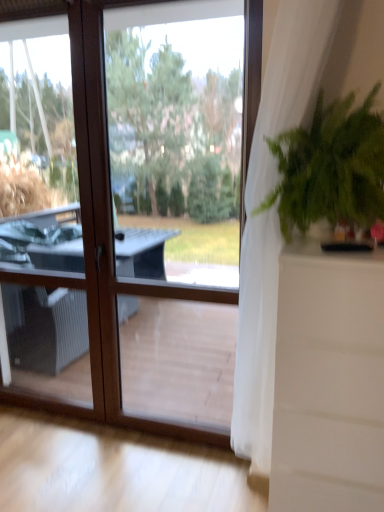
Find the location of a particular element. The width and height of the screenshot is (384, 512). transparent glass window at center is located at coordinates (102, 227).

Where is `green leafy plant at right`? The width and height of the screenshot is (384, 512). green leafy plant at right is located at coordinates (330, 168).

Locate an element on the screen. The image size is (384, 512). white sheer curtain at right is located at coordinates (272, 216).

How different are the orientations of white sheer curtain at right and transparent glass window at center in degrees?

white sheer curtain at right and transparent glass window at center are facing 0.000555 degrees away from each other.

Is white sheer curtain at right facing towards transparent glass window at center?

No, white sheer curtain at right is not turned towards transparent glass window at center.

From the picture: How distant is white sheer curtain at right from transparent glass window at center?

white sheer curtain at right and transparent glass window at center are 31.22 inches apart.

From the image's perspective, is white sheer curtain at right located above or below transparent glass window at center?

Clearly, from the image's perspective, white sheer curtain at right is below transparent glass window at center.

Measure the distance between transparent glass window at center and green leafy plant at right.

89.57 centimeters.

Looking at this image, does transparent glass window at center appear on the right side of green leafy plant at right?

Incorrect, transparent glass window at center is not on the right side of green leafy plant at right.

Locate an element on the screen. Image resolution: width=384 pixels, height=512 pixels. houseplant in front of the transparent glass window at center is located at coordinates (330, 168).

From a real-world perspective, is transparent glass window at center on top of green leafy plant at right?

No, from a real-world perspective, transparent glass window at center is not over green leafy plant at right

How much distance is there between transparent glass window at center and white sheer curtain at right?

transparent glass window at center and white sheer curtain at right are 31.22 inches apart.

Locate an element on the screen. This screenshot has width=384, height=512. window below the white sheer curtain at right (from a real-world perspective) is located at coordinates (102, 227).

Looking at their sizes, would you say transparent glass window at center is wider or thinner than white sheer curtain at right?

transparent glass window at center is thinner than white sheer curtain at right.

Are green leafy plant at right and white sheer curtain at right far apart?

No, green leafy plant at right is not far away from white sheer curtain at right.

From a real-world perspective, is green leafy plant at right above or below white sheer curtain at right?

From a real-world perspective, green leafy plant at right is physically above white sheer curtain at right.

Would you say green leafy plant at right is outside white sheer curtain at right?

That's incorrect, green leafy plant at right is not completely outside white sheer curtain at right.

Which is closer, (379, 162) or (311, 33)?

Point (379, 162) is closer to the camera than point (311, 33).

Is green leafy plant at right with transparent glass window at center?

No, green leafy plant at right is not touching transparent glass window at center.

Looking at this image, considering the sizes of objects green leafy plant at right and transparent glass window at center in the image provided, who is shorter, green leafy plant at right or transparent glass window at center?

green leafy plant at right is shorter.

Is green leafy plant at right situated inside transparent glass window at center or outside?

The correct answer is: outside.

Who is shorter, white sheer curtain at right or green leafy plant at right?

green leafy plant at right.

Between point (288, 11) and point (367, 217), which one is positioned behind?

The point (288, 11) is farther.

Find the location of a particular element. The height and width of the screenshot is (512, 384). window that appears behind the white sheer curtain at right is located at coordinates (102, 227).

What are the coordinates of `houseplant in front of the transparent glass window at center` in the screenshot? It's located at (330, 168).

Based on the photo, based on their spatial positions, is transparent glass window at center or white sheer curtain at right further from green leafy plant at right?

Based on the image, transparent glass window at center appears to be further to green leafy plant at right.

Considering their positions, is white sheer curtain at right positioned closer to transparent glass window at center than green leafy plant at right?

white sheer curtain at right lies closer to transparent glass window at center than the other object.

Based on their spatial positions, is white sheer curtain at right or transparent glass window at center closer to green leafy plant at right?

white sheer curtain at right lies closer to green leafy plant at right than the other object.

Which object lies further to the anchor point transparent glass window at center, green leafy plant at right or white sheer curtain at right?

green leafy plant at right lies further to transparent glass window at center than the other object.

Which object lies nearer to the anchor point white sheer curtain at right, green leafy plant at right or transparent glass window at center?

Among the two, green leafy plant at right is located nearer to white sheer curtain at right.

When comparing their distances from white sheer curtain at right, does transparent glass window at center or green leafy plant at right seem closer?

Among the two, green leafy plant at right is located nearer to white sheer curtain at right.

I want to click on curtain located between transparent glass window at center and green leafy plant at right in the left-right direction, so click(272, 216).